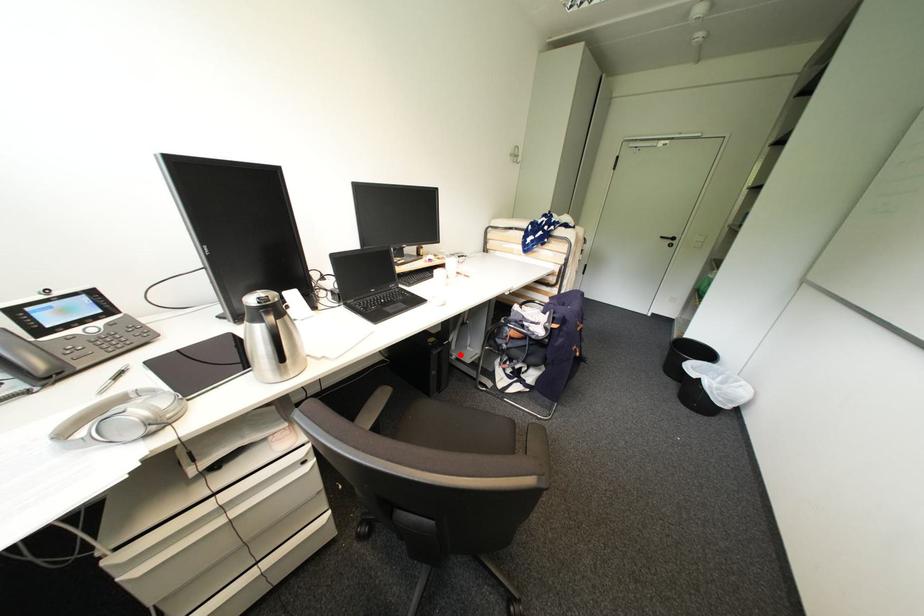
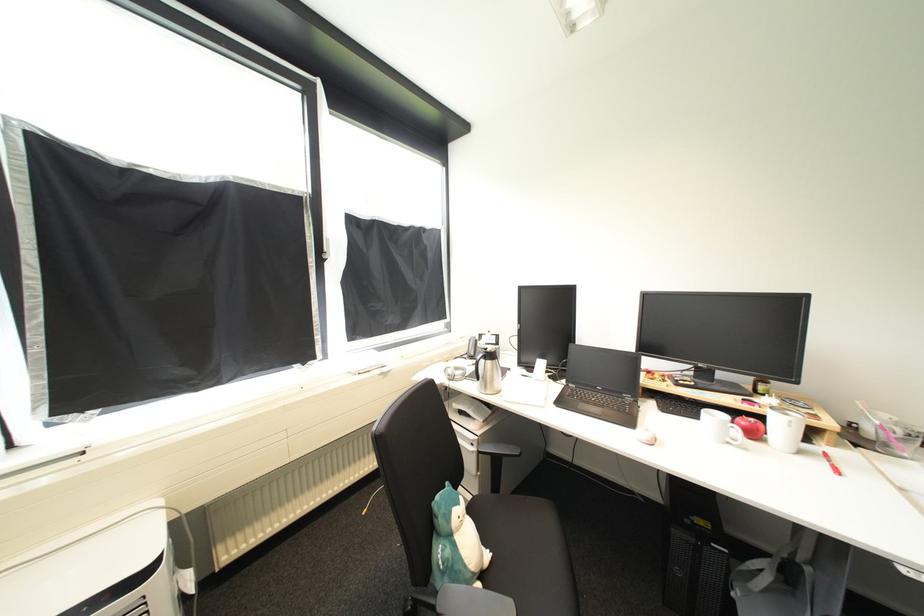
Question: A red point is marked in image1. In image2, is the corresponding 3D point closer to the camera or farther? Reply with the corresponding letter.

Choices:
 (A) The corresponding 3D point is closer.
 (B) The corresponding 3D point is farther.

Answer: (B)